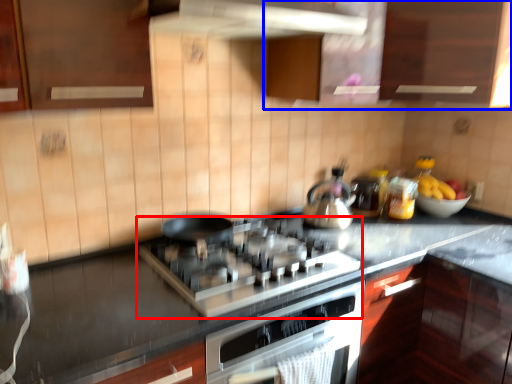
Question: Among these objects, which one is nearest to the camera, gas stove (highlighted by a red box) or cabinetry (highlighted by a blue box)?

Choices:
 (A) gas stove
 (B) cabinetry

Answer: (A)